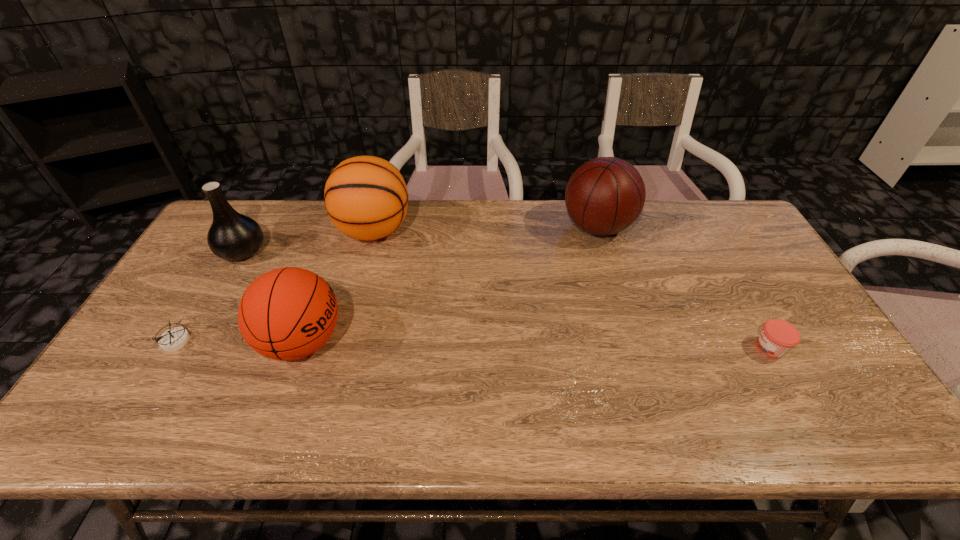
Find the location of a particular element. This screenshot has width=960, height=540. the fifth object from left to right is located at coordinates (604, 196).

This screenshot has height=540, width=960. Find the location of `vase`. vase is located at coordinates (232, 236).

The width and height of the screenshot is (960, 540). Identify the location of the nearest basketball. (289, 313).

Image resolution: width=960 pixels, height=540 pixels. Identify the location of the rightmost object. (777, 337).

The image size is (960, 540). In order to click on the fifth tallest object in this screenshot , I will do `click(777, 337)`.

This screenshot has width=960, height=540. Find the location of `the shortest object`. the shortest object is located at coordinates (173, 339).

I want to click on free region located 0.070m on the right of the fifth object from left to right, so click(655, 227).

Identify the location of vacant region located 0.290m on the front of the vase. (188, 345).

The height and width of the screenshot is (540, 960). In order to click on vacant region located on the side with logo of the nearest basketball in this screenshot , I will do `click(419, 342)`.

What are the coordinates of `free space located 0.050m on the front label of the jam` in the screenshot? It's located at (734, 348).